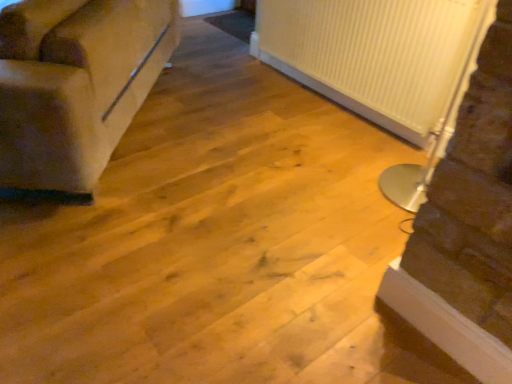
Locate an element on the screen. Image resolution: width=512 pixels, height=384 pixels. vacant space behind white ribbed radiator at right is located at coordinates (345, 133).